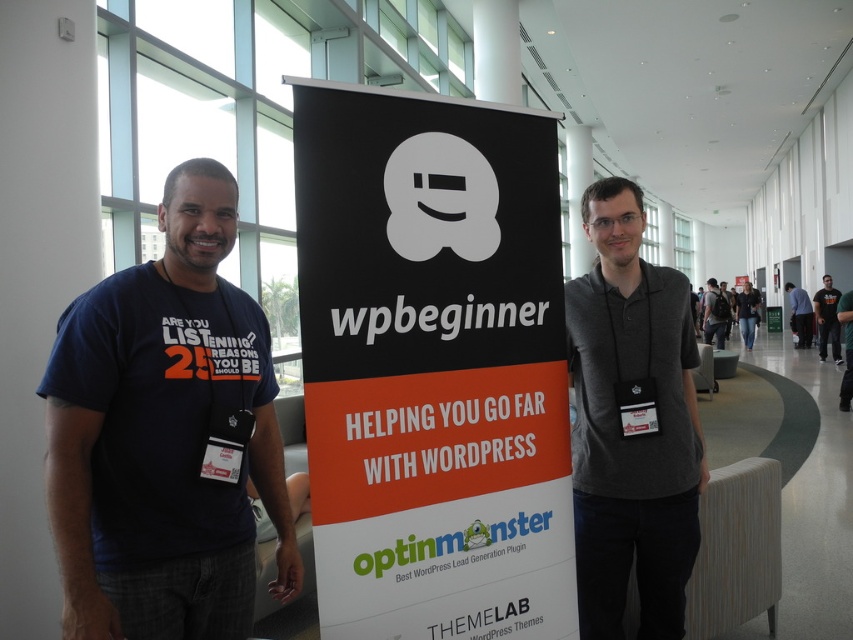
Consider the image. You are an event organizer who wants to ensure that the black paper banner at center is visible to all attendees. Considering the height of the gray fabric shirt at right, is the banner likely placed at an appropriate height for visibility?

The black paper banner at center has a lesser height compared to gray fabric shirt at right, so it may not be placed at an appropriate height for visibility since it is shorter than the gray fabric shirt at right.